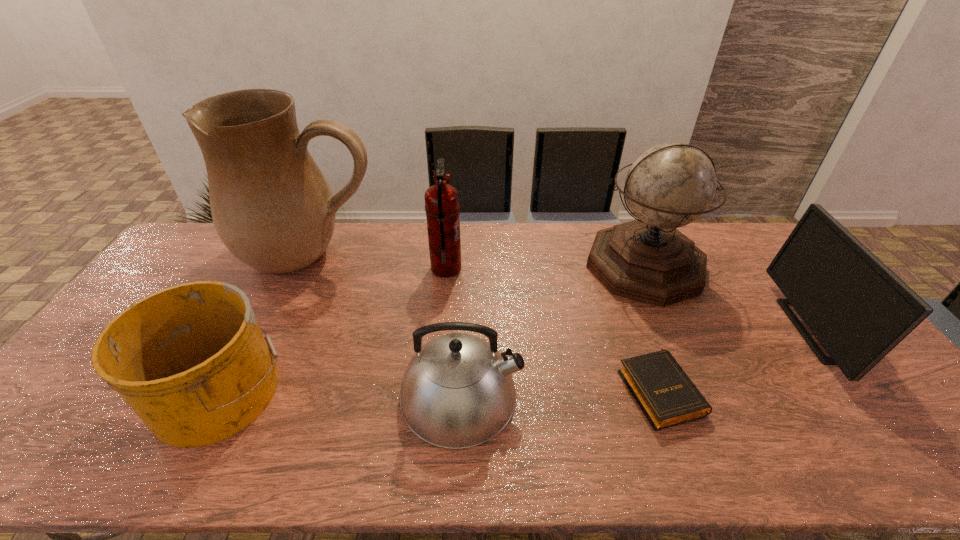
Where is `unoccupied area between the tallest object and the second tallest object`? unoccupied area between the tallest object and the second tallest object is located at coordinates (478, 261).

I want to click on vacant space that's between the Bible and the kettle, so click(561, 392).

This screenshot has height=540, width=960. In order to click on free spot between the fire extinguisher and the tallest object in this screenshot , I will do `click(378, 262)`.

Locate which object ranks fifth in proximity to the cream pitcher. Please provide its 2D coordinates. Your answer should be formatted as a tuple, i.e. [(x, y)], where the tuple contains the x and y coordinates of a point satisfying the conditions above.

[(665, 394)]

You are a GUI agent. You are given a task and a screenshot of the screen. Output one action in this format:
    pyautogui.click(x=<x>, y=<y>)
    Task: Click on the object that is the fifth closest to the third tallest object
    The height and width of the screenshot is (540, 960).
    Given the screenshot: What is the action you would take?
    pyautogui.click(x=665, y=394)

The width and height of the screenshot is (960, 540). I want to click on free space in the image that satisfies the following two spatial constraints: 1. on the screen side of the rightmost object; 2. on the front side of the shortest object, so click(x=869, y=390).

Find the location of a particular element. The height and width of the screenshot is (540, 960). vacant position in the image that satisfies the following two spatial constraints: 1. on the side of the fifth shortest object with the handle and hose; 2. on the front side of the bucket is located at coordinates (435, 390).

Where is `free space that satisfies the following two spatial constraints: 1. on the surface of the sixth shortest object; 2. from the spout of the kettle`? Image resolution: width=960 pixels, height=540 pixels. free space that satisfies the following two spatial constraints: 1. on the surface of the sixth shortest object; 2. from the spout of the kettle is located at coordinates (701, 395).